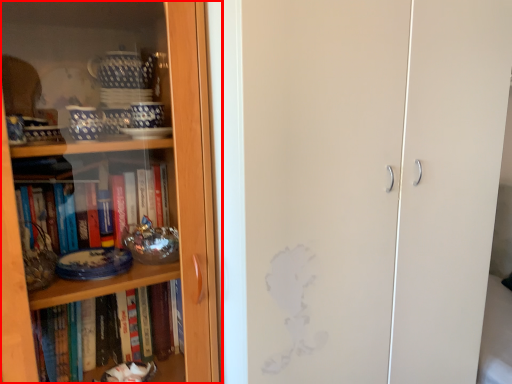
Question: Where is bookcase (annotated by the red box) located in relation to screen door in the image?

Choices:
 (A) left
 (B) right

Answer: (A)